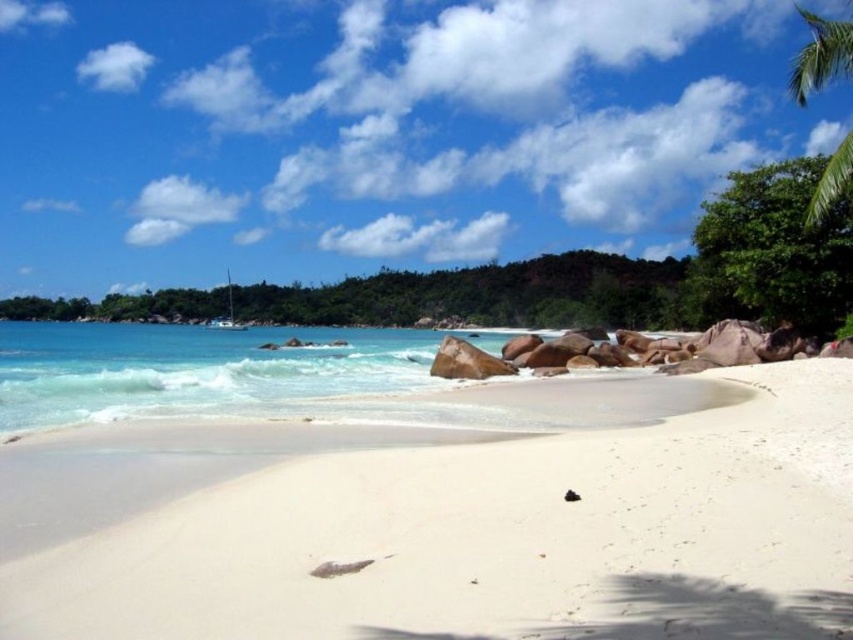
Which is below, clear blue water at lower left or green leafy palm tree at upper right?

clear blue water at lower left

Which of these two, clear blue water at lower left or green leafy palm tree at upper right, stands taller?

green leafy palm tree at upper right

Between point (6, 349) and point (813, 52), which one is positioned behind?

Positioned behind is point (6, 349).

Locate an element on the screen. The width and height of the screenshot is (853, 640). clear blue water at lower left is located at coordinates (215, 372).

Is white sandy beach at center in front of green leafy palm tree at upper right?

Yes, white sandy beach at center is in front of green leafy palm tree at upper right.

The image size is (853, 640). Describe the element at coordinates (495, 538) in the screenshot. I see `white sandy beach at center` at that location.

Where is `white sandy beach at center`? white sandy beach at center is located at coordinates (495, 538).

Does white sandy beach at center appear under clear blue water at lower left?

Yes, white sandy beach at center is below clear blue water at lower left.

Is point (450, 540) positioned behind point (276, 387)?

No, it is in front of (276, 387).

Which is in front, point (303, 586) or point (132, 394)?

Point (303, 586) is in front.

Find the location of a particular element. The image size is (853, 640). white sandy beach at center is located at coordinates (495, 538).